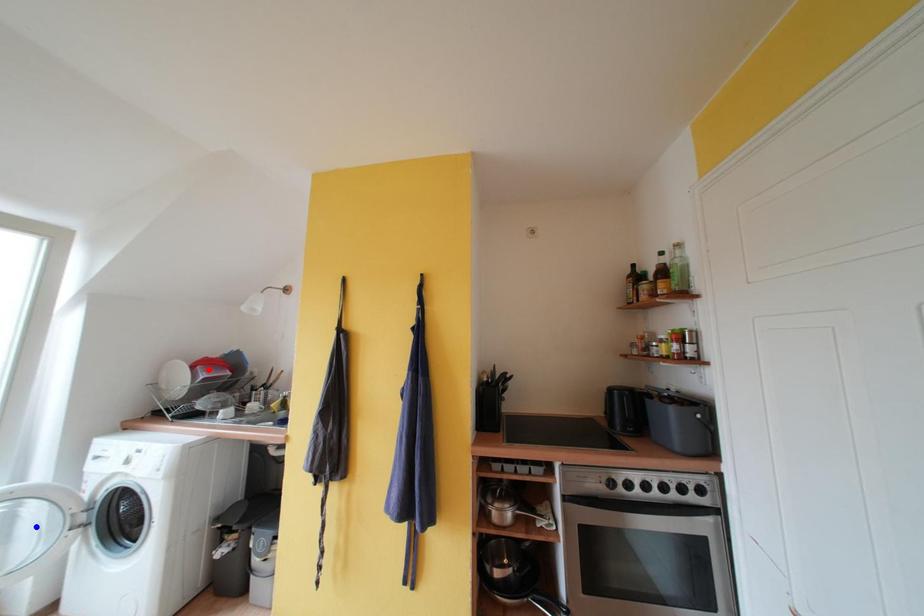
Question: Two points are marked on the image. Which point is closer to the camera?

Choices:
 (A) Blue point is closer.
 (B) Red point is closer.

Answer: (A)